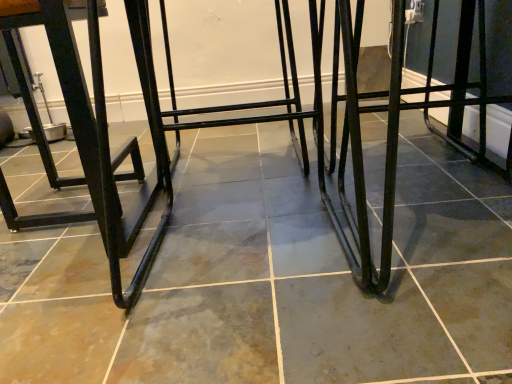
Question: Is black metal frame at left next to black metal step stool at center and touching it?

Choices:
 (A) no
 (B) yes

Answer: (A)

Question: Is black metal frame at left at the left side of black metal step stool at center?

Choices:
 (A) no
 (B) yes

Answer: (B)

Question: Can you confirm if black metal frame at left is positioned to the right of black metal step stool at center?

Choices:
 (A) no
 (B) yes

Answer: (A)

Question: Is black metal frame at left bigger than black metal step stool at center?

Choices:
 (A) no
 (B) yes

Answer: (A)

Question: From the image's perspective, does black metal frame at left appear higher than black metal step stool at center?

Choices:
 (A) no
 (B) yes

Answer: (B)

Question: Does black metal frame at left have a lesser width compared to black metal step stool at center?

Choices:
 (A) no
 (B) yes

Answer: (B)

Question: From the image's perspective, is black metal step stool at center on top of black metal frame at left?

Choices:
 (A) no
 (B) yes

Answer: (A)

Question: Does black metal step stool at center come in front of black metal frame at left?

Choices:
 (A) no
 (B) yes

Answer: (B)

Question: Are black metal step stool at center and black metal frame at left far apart?

Choices:
 (A) yes
 (B) no

Answer: (B)

Question: Is black metal frame at left surrounded by black metal step stool at center?

Choices:
 (A) no
 (B) yes

Answer: (A)

Question: Considering the relative sizes of black metal step stool at center and black metal frame at left in the image provided, is black metal step stool at center thinner than black metal frame at left?

Choices:
 (A) yes
 (B) no

Answer: (B)

Question: Can you confirm if black metal step stool at center is bigger than black metal frame at left?

Choices:
 (A) no
 (B) yes

Answer: (B)

Question: Which is correct: black metal frame at left is inside black metal step stool at center, or outside of it?

Choices:
 (A) inside
 (B) outside

Answer: (B)